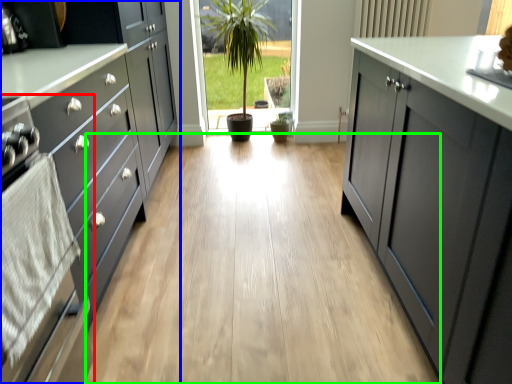
Question: Which is farther away from oven (highlighted by a red box)? cabinetry (highlighted by a blue box) or plain (highlighted by a green box)?

Choices:
 (A) cabinetry
 (B) plain

Answer: (B)